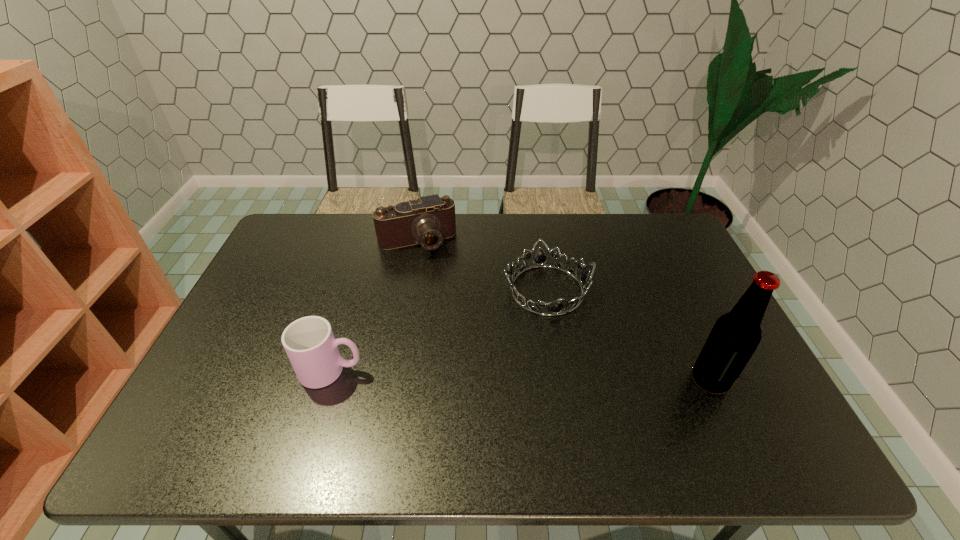
Where is `vacant area that lies between the camera and the shortest object`? Image resolution: width=960 pixels, height=540 pixels. vacant area that lies between the camera and the shortest object is located at coordinates (482, 266).

Find the location of a particular element. free spot between the cup and the camera is located at coordinates (374, 306).

I want to click on vacant space in between the cup and the second farthest object, so click(x=439, y=330).

Where is `object that is the second closest to the cup`? This screenshot has width=960, height=540. object that is the second closest to the cup is located at coordinates (428, 220).

Where is `object that is the third closest one to the farthest object`? Image resolution: width=960 pixels, height=540 pixels. object that is the third closest one to the farthest object is located at coordinates (735, 336).